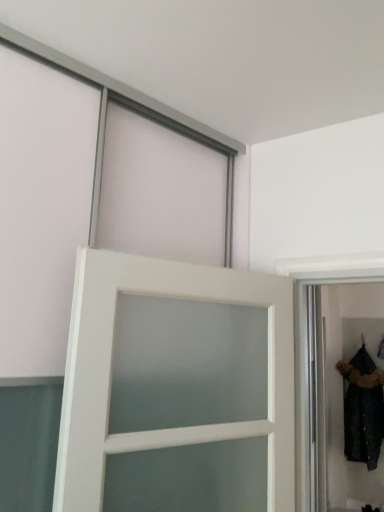
Measure the distance between dark fur-trimmed coat at right and camera.

A distance of 3.57 meters exists between dark fur-trimmed coat at right and camera.

You are a GUI agent. You are given a task and a screenshot of the screen. Output one action in this format:
    pyautogui.click(x=<x>, y=<y>)
    Task: Click on the dark fur-trimmed coat at right
    Image resolution: width=384 pixels, height=512 pixels.
    Given the screenshot: What is the action you would take?
    pyautogui.click(x=363, y=408)

Describe the element at coordinates (363, 408) in the screenshot. I see `dark fur-trimmed coat at right` at that location.

You are a GUI agent. You are given a task and a screenshot of the screen. Output one action in this format:
    pyautogui.click(x=<x>, y=<y>)
    Task: Click on the dark fur-trimmed coat at right
    The height and width of the screenshot is (512, 384).
    Given the screenshot: What is the action you would take?
    pyautogui.click(x=363, y=408)